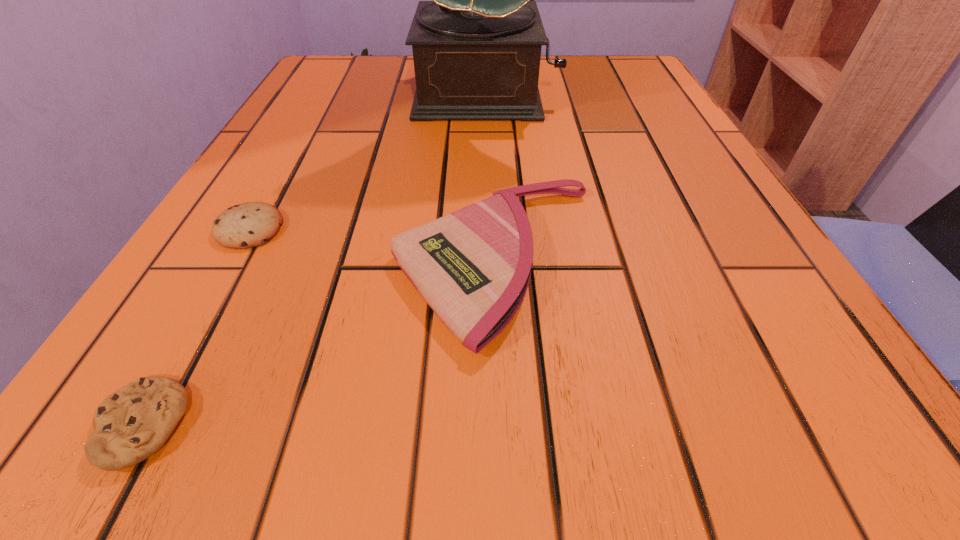
You are a GUI agent. You are given a task and a screenshot of the screen. Output one action in this format:
    pyautogui.click(x=<x>, y=<y>)
    Task: Click on the record player
    This screenshot has height=540, width=960.
    Given the screenshot: What is the action you would take?
    pyautogui.click(x=476, y=47)

This screenshot has height=540, width=960. Find the location of `the farthest object`. the farthest object is located at coordinates (476, 47).

Identify the location of wristlet. This screenshot has height=540, width=960. (473, 266).

Find the location of `the farther cookie`. the farther cookie is located at coordinates (251, 224).

Image resolution: width=960 pixels, height=540 pixels. I want to click on the nearest object, so click(x=134, y=422).

Where is `vacant region located on the horn of the tallest object`? vacant region located on the horn of the tallest object is located at coordinates (489, 168).

The height and width of the screenshot is (540, 960). I want to click on free space located on the back of the wristlet, so click(492, 139).

This screenshot has height=540, width=960. Identify the location of vacant space located 0.270m on the back of the farther cookie. (310, 120).

Where is `vacant area situated 0.060m on the right of the nearest object`? The height and width of the screenshot is (540, 960). vacant area situated 0.060m on the right of the nearest object is located at coordinates (251, 425).

The width and height of the screenshot is (960, 540). Identify the location of object at the far edge. (476, 47).